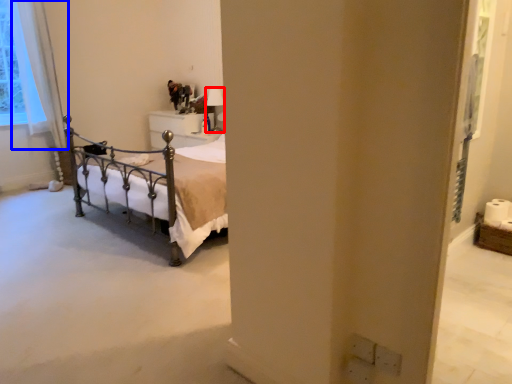
Question: Which object is closer to the camera taking this photo, lamp (highlighted by a red box) or curtain (highlighted by a blue box)?

Choices:
 (A) lamp
 (B) curtain

Answer: (B)